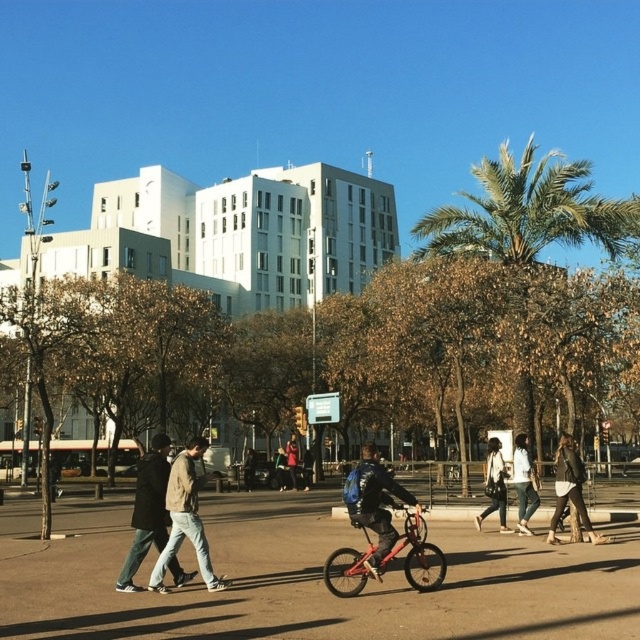
You are standing in the urban scene and see the light brown leather jacket at center and the white matte jacket at center. Which jacket is positioned to the left?

The light brown leather jacket at center is to the left of the white matte jacket at center.

You are standing at the point with coordinates point (417, 554). What object are you on?

You are on the metallic red bicycle at center.

You are standing at the point with coordinates point [458,480] and want to walk to the point with coordinates point [131,525]. Is the destination point in front of you or behind you?

The destination point point [131,525] is in front of point [458,480], so the destination is in front of you.